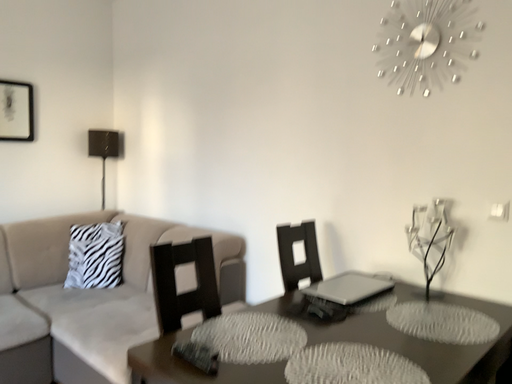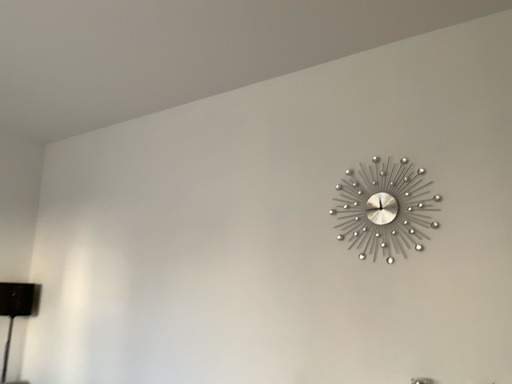
Question: How did the camera likely rotate when shooting the video?

Choices:
 (A) rotated upward
 (B) rotated downward

Answer: (A)